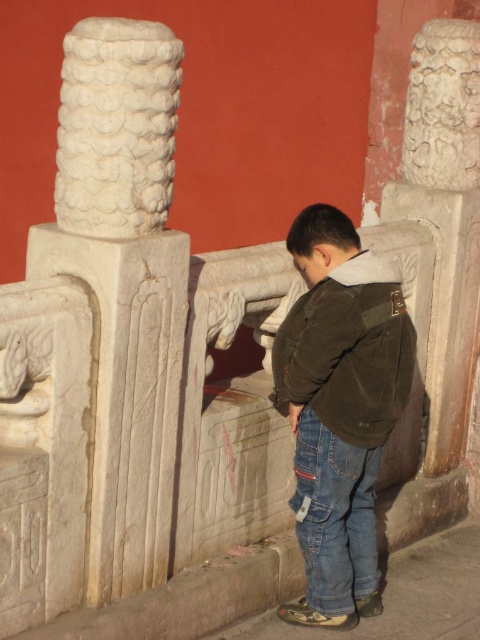
Question: Which of these objects is positioned farthest from the brown corduroy jacket at center?

Choices:
 (A) white stone column at upper left
 (B) dark brown corduroy jacket at center
 (C) blue denim jeans at lower center
 (D) white stone column at center

Answer: (A)

Question: From the image, what is the correct spatial relationship of brown corduroy jacket at center in relation to blue denim jeans at lower center?

Choices:
 (A) left
 (B) right

Answer: (B)

Question: Where is white stone column at center located in relation to white stone column at upper left in the image?

Choices:
 (A) below
 (B) above

Answer: (A)

Question: Is dark brown corduroy jacket at center to the right of white stone column at upper left from the viewer's perspective?

Choices:
 (A) yes
 (B) no

Answer: (A)

Question: Which object appears farthest from the camera in this image?

Choices:
 (A) brown corduroy jacket at center
 (B) white stone column at center

Answer: (A)

Question: Which point is farther from the camera taking this photo?

Choices:
 (A) (x=145, y=365)
 (B) (x=98, y=221)

Answer: (A)